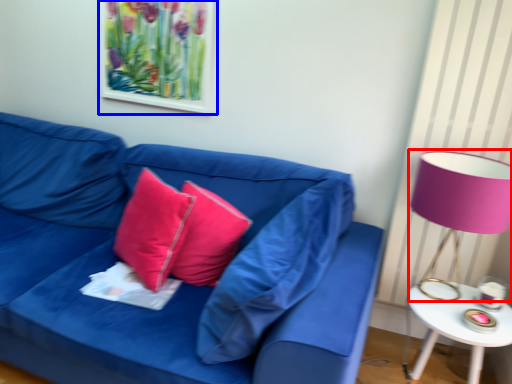
Question: Which of the following is the closest to the observer, table lamp (highlighted by a red box) or picture frame (highlighted by a blue box)?

Choices:
 (A) table lamp
 (B) picture frame

Answer: (A)